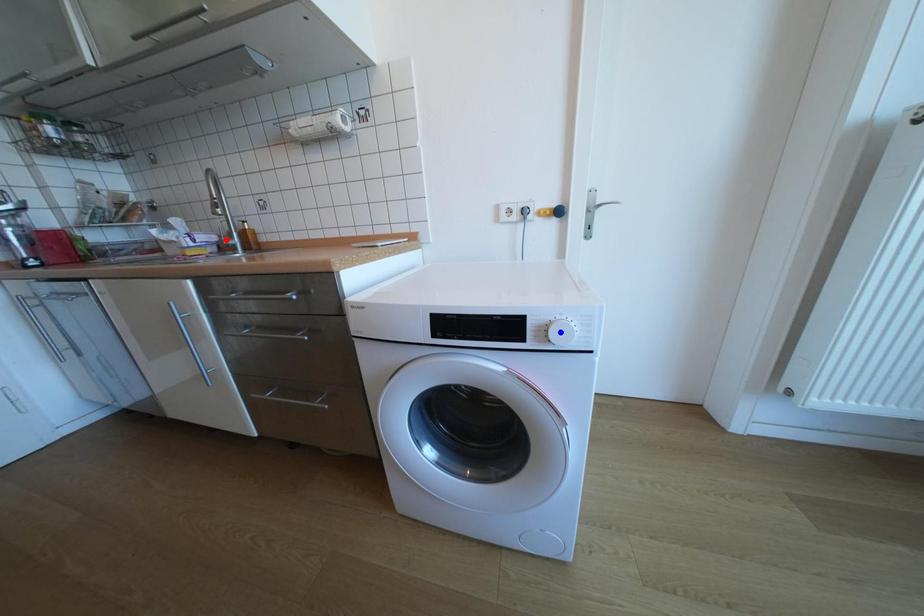
Question: Which of the two points in the image is closer to the camera?

Choices:
 (A) Blue point is closer.
 (B) Red point is closer.

Answer: (A)